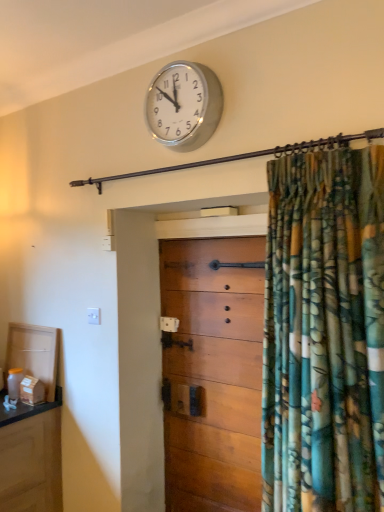
Question: Should I look upward or downward to see wooden chest of drawers at center?

Choices:
 (A) down
 (B) up

Answer: (A)

Question: Is wooden chest of drawers at center behind silver metallic clock at upper center?

Choices:
 (A) yes
 (B) no

Answer: (A)

Question: Does wooden chest of drawers at center have a smaller size compared to silver metallic clock at upper center?

Choices:
 (A) yes
 (B) no

Answer: (B)

Question: Is wooden chest of drawers at center in contact with silver metallic clock at upper center?

Choices:
 (A) no
 (B) yes

Answer: (A)

Question: Does wooden chest of drawers at center have a lesser width compared to silver metallic clock at upper center?

Choices:
 (A) no
 (B) yes

Answer: (A)

Question: Would you say silver metallic clock at upper center is part of wooden chest of drawers at center's contents?

Choices:
 (A) yes
 (B) no

Answer: (B)

Question: Considering the relative positions of wooden chest of drawers at center and silver metallic clock at upper center in the image provided, is wooden chest of drawers at center in front of silver metallic clock at upper center?

Choices:
 (A) yes
 (B) no

Answer: (B)

Question: Are silver metallic clock at upper center and wooden chest of drawers at center making contact?

Choices:
 (A) yes
 (B) no

Answer: (B)

Question: From a real-world perspective, is silver metallic clock at upper center positioned under wooden chest of drawers at center based on gravity?

Choices:
 (A) yes
 (B) no

Answer: (B)

Question: Can you confirm if silver metallic clock at upper center is smaller than wooden chest of drawers at center?

Choices:
 (A) yes
 (B) no

Answer: (A)

Question: From a real-world perspective, is silver metallic clock at upper center positioned over wooden chest of drawers at center based on gravity?

Choices:
 (A) yes
 (B) no

Answer: (A)

Question: From the image's perspective, is silver metallic clock at upper center on top of wooden chest of drawers at center?

Choices:
 (A) yes
 (B) no

Answer: (A)

Question: Is silver metallic clock at upper center closer to the viewer compared to wooden chest of drawers at center?

Choices:
 (A) no
 (B) yes

Answer: (B)

Question: Is wooden chest of drawers at center in front of or behind silver metallic clock at upper center in the image?

Choices:
 (A) behind
 (B) front

Answer: (A)